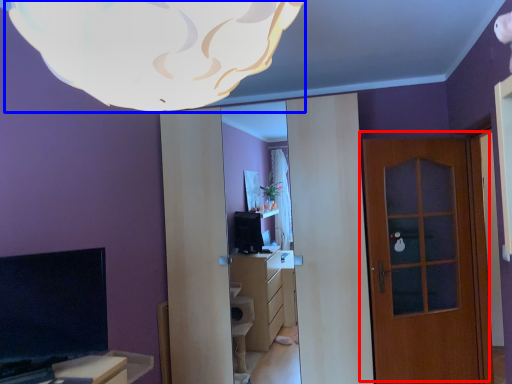
Question: Which object is closer to the camera taking this photo, door (highlighted by a red box) or lamp (highlighted by a blue box)?

Choices:
 (A) door
 (B) lamp

Answer: (B)